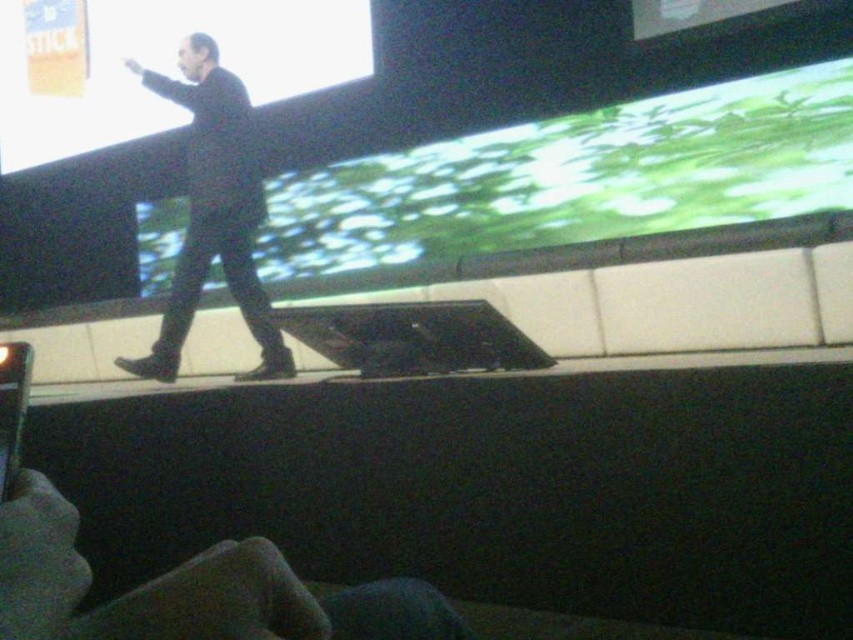
You are an event planner arranging the seating for the audience. You need to ensure that everyone can see both the green matte projection screen at upper center and the black matte suit at center. Which object is positioned higher in the image?

The green matte projection screen at upper center is positioned higher than the black matte suit at center.

You are an event organizer setting up the room for a presentation. You need to adjust the lighting so that the speaker can be seen clearly while ensuring the green matte projection screen at upper center and the matte black screen at upper center are both visible. Which screen should you position closer to the front to ensure better visibility?

The green matte projection screen at upper center should be positioned closer to the front because it is to the right of the matte black screen at upper center, making it more accessible and visible from the audience perspective.

Based on the photo, you are an event organizer who needs to adjust the seating arrangement for better visibility. The room has limited space, so you must determine if the matte black screen at upper center can be moved closer to the black matte suit at center without blocking the speaker. Can you confirm if there is enough space between them?

The matte black screen at upper center might be wider than the black matte suit at center, so moving it closer could potentially block the speaker depending on their positioning. Check the actual dimensions before making adjustments.